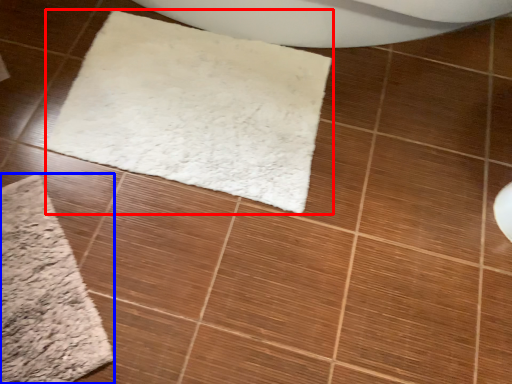
Question: Which of the following is the farthest to the observer, mat (highlighted by a red box) or bath mat (highlighted by a blue box)?

Choices:
 (A) mat
 (B) bath mat

Answer: (A)